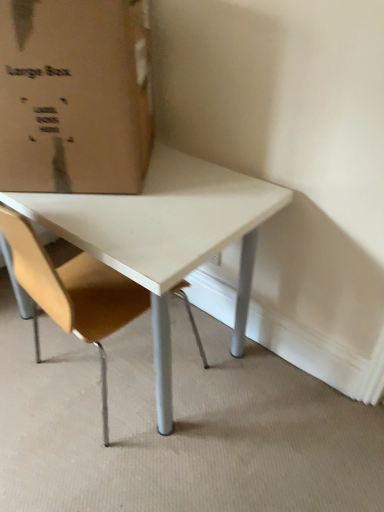
Where is `vacant region to the right of light brown leather chair at center`? This screenshot has width=384, height=512. vacant region to the right of light brown leather chair at center is located at coordinates (229, 396).